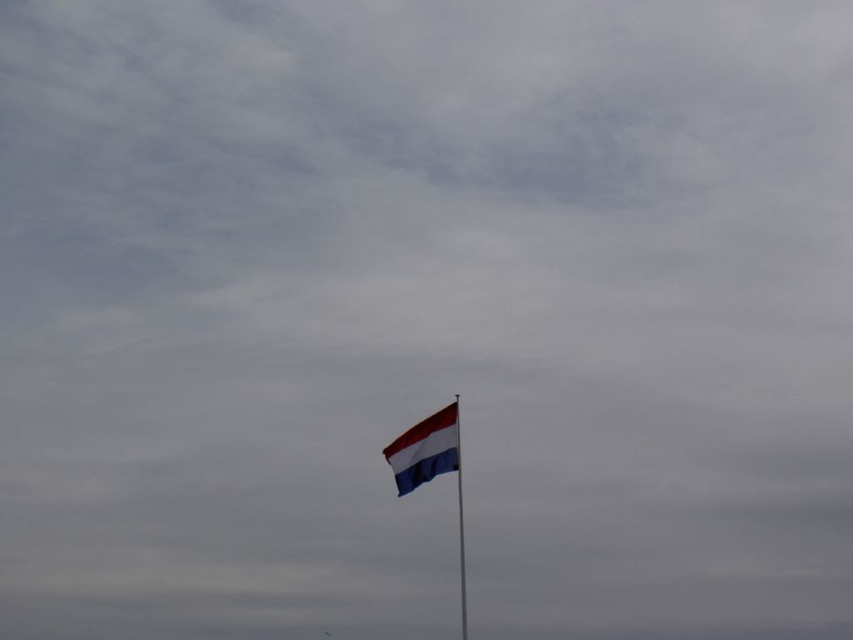
Is striped fabric flag at center below metallic flag pole at center?

Actually, striped fabric flag at center is above metallic flag pole at center.

In the scene shown: Which is more to the left, striped fabric flag at center or metallic flag pole at center?

Positioned to the left is striped fabric flag at center.

This screenshot has height=640, width=853. Describe the element at coordinates (425, 449) in the screenshot. I see `striped fabric flag at center` at that location.

Identify the location of striped fabric flag at center. (425, 449).